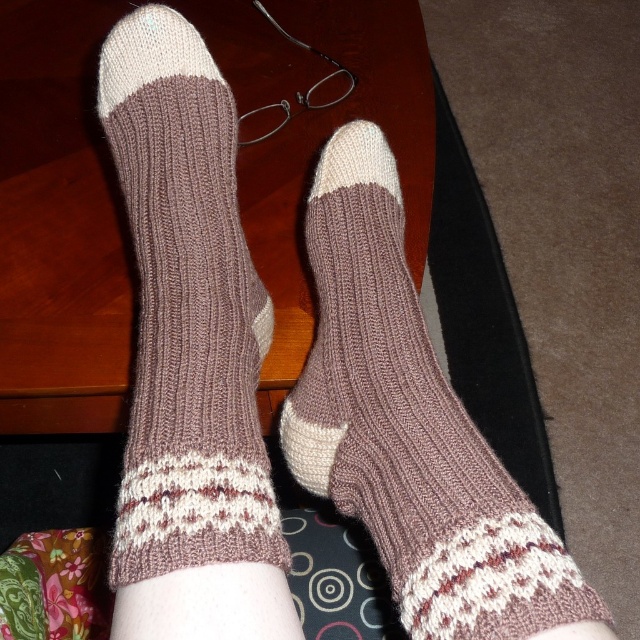
Question: Which point is farther to the camera?

Choices:
 (A) knit brown socks at center
 (B) brown knitted sock at center

Answer: (A)

Question: In this image, where is brown knitted sock at center located relative to knit brown socks at center?

Choices:
 (A) above
 (B) below

Answer: (B)

Question: Which of the following is the closest to the observer?

Choices:
 (A) knit brown socks at center
 (B) brown knitted sock at center

Answer: (B)

Question: Can you confirm if brown knitted sock at center is positioned above knit brown socks at center?

Choices:
 (A) yes
 (B) no

Answer: (B)

Question: In this image, where is brown knitted sock at center located relative to knit brown socks at center?

Choices:
 (A) right
 (B) left

Answer: (A)